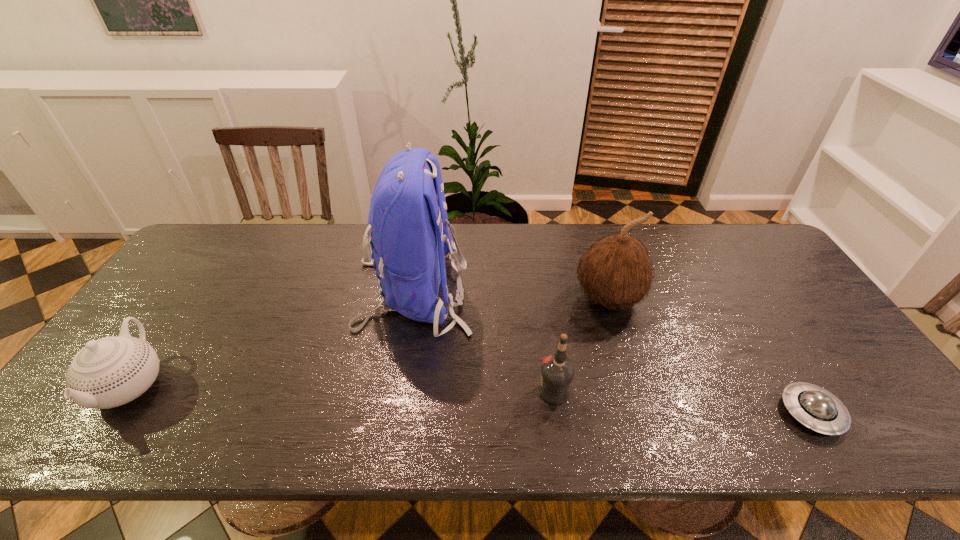
Find the location of `unoccupied position between the second shortest object and the fourth object from right to left`. unoccupied position between the second shortest object and the fourth object from right to left is located at coordinates (272, 339).

Locate an element on the screen. This screenshot has height=540, width=960. vacant region between the fourth shortest object and the third object from right to left is located at coordinates (581, 345).

The image size is (960, 540). I want to click on empty space that is in between the vodka and the second object from right to left, so click(581, 345).

Locate an element on the screen. Image resolution: width=960 pixels, height=540 pixels. free space between the vodka and the shortest object is located at coordinates (683, 402).

Image resolution: width=960 pixels, height=540 pixels. What are the coordinates of `vacant region between the fourth shortest object and the backpack` in the screenshot? It's located at (511, 295).

Identify the location of vacant space that's between the fourth tallest object and the vodka. The height and width of the screenshot is (540, 960). (343, 388).

The width and height of the screenshot is (960, 540). In order to click on free space between the fourth shortest object and the shortest object in this screenshot , I will do `click(709, 356)`.

Locate an element on the screen. The height and width of the screenshot is (540, 960). free space between the chinaware and the third object from right to left is located at coordinates (343, 388).

Where is `object that is the closest to the third object from right to left`? The height and width of the screenshot is (540, 960). object that is the closest to the third object from right to left is located at coordinates (616, 271).

This screenshot has width=960, height=540. In order to click on object identified as the second closest to the saucer in this screenshot , I will do `click(557, 371)`.